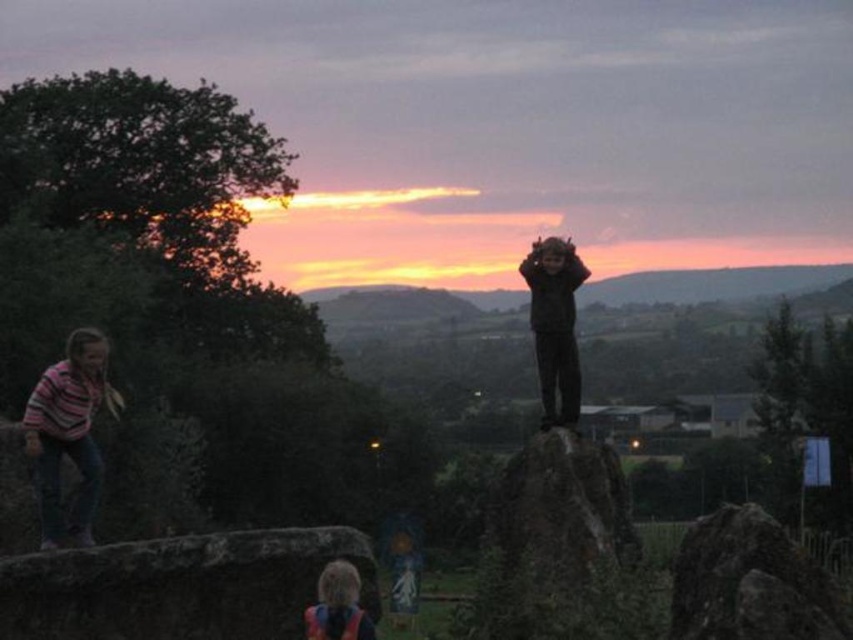
Which is behind, point (695, 598) or point (556, 378)?

The point (556, 378) is more distant.

Is point (821, 577) positioned before point (570, 422)?

Yes, it is.

Is point (708, 570) more distant than point (566, 292)?

That is False.

Locate an element on the screen. This screenshot has height=640, width=853. rough stone boulder at center is located at coordinates (749, 582).

Between rough stone boulder at lower left and dark gray hoodie at center, which one has less height?

Standing shorter between the two is rough stone boulder at lower left.

Looking at this image, is rough stone boulder at lower left closer to camera compared to dark gray hoodie at center?

Yes, it is in front of dark gray hoodie at center.

I want to click on rough stone boulder at lower left, so click(178, 586).

Which is more to the left, rough stone boulder at center or orange safety vest at lower center?

Positioned to the left is orange safety vest at lower center.

Based on the photo, is rough stone boulder at center wider than orange safety vest at lower center?

Indeed, rough stone boulder at center has a greater width compared to orange safety vest at lower center.

Who is more distant from viewer, (737,552) or (358,630)?

Point (358,630)

Where is `rough stone boulder at center`? rough stone boulder at center is located at coordinates (749, 582).